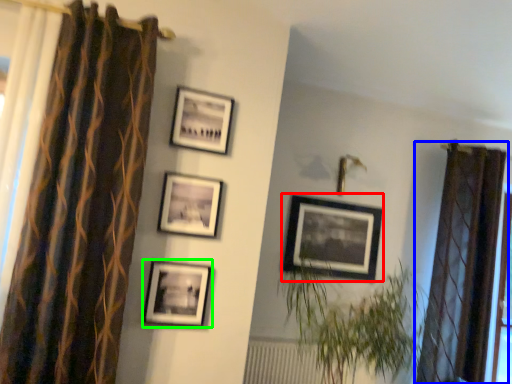
Question: Based on their relative distances, which object is nearer to picture frame (highlighted by a red box)? Choose from curtain (highlighted by a blue box) and picture frame (highlighted by a green box).

Choices:
 (A) curtain
 (B) picture frame

Answer: (A)